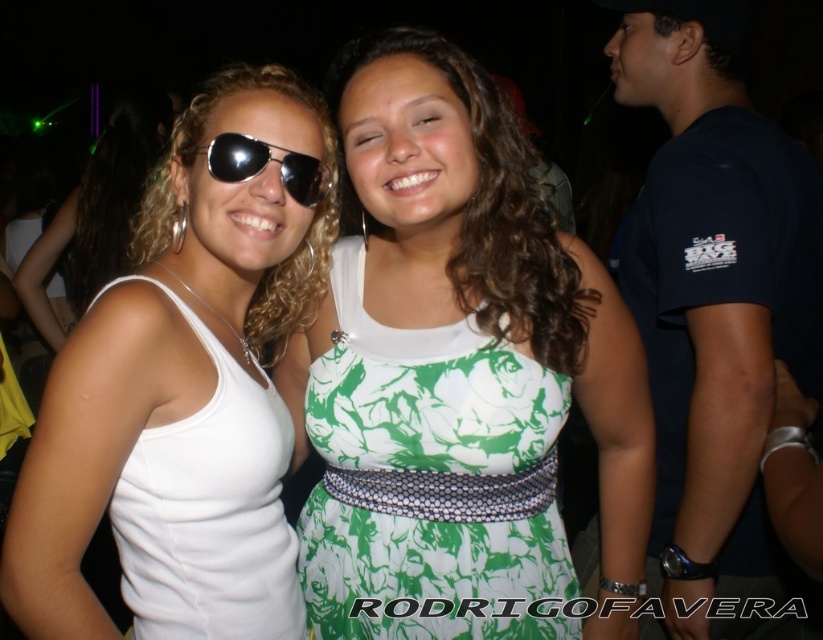
Question: Is white fabric dress at left positioned in front of shiny black aviator sunglasses at center?

Choices:
 (A) no
 (B) yes

Answer: (B)

Question: Which of the following is the closest to the observer?

Choices:
 (A) coord(7,589)
 (B) coord(347,65)
 (C) coord(394,392)
 (D) coord(249,467)

Answer: (A)

Question: Is green floral fabric dress at center wider than white fabric dress at left?

Choices:
 (A) yes
 (B) no

Answer: (A)

Question: Is green floral dress at center to the right of white fabric dress at left from the viewer's perspective?

Choices:
 (A) yes
 (B) no

Answer: (A)

Question: Which object is the closest to the green floral dress at center?

Choices:
 (A) green floral fabric dress at center
 (B) shiny black aviator sunglasses at center
 (C) white matte tank top at center
 (D) green printed dress at center

Answer: (A)

Question: Which of these objects is positioned closest to the green floral dress at center?

Choices:
 (A) green floral fabric dress at center
 (B) green printed dress at center

Answer: (A)